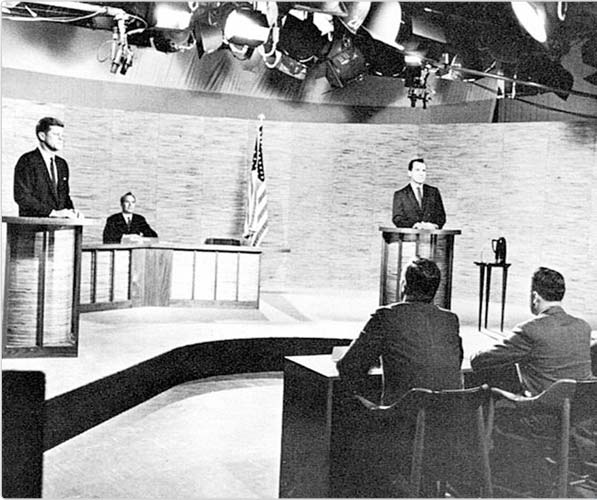
Locate an element on the screen. Image resolution: width=597 pixels, height=500 pixels. pitcher is located at coordinates (500, 247).